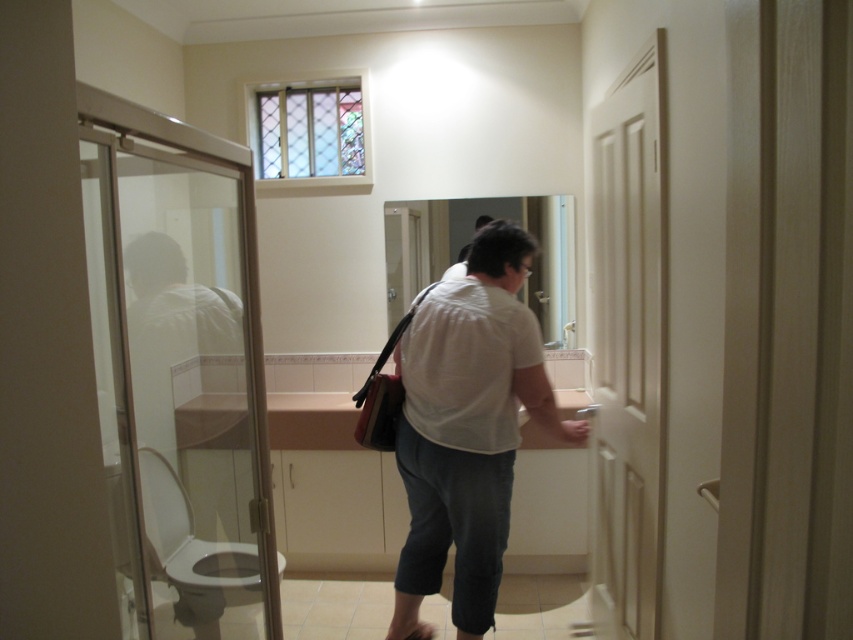
Between point (654, 579) and point (576, 376), which one is positioned in front?

Positioned in front is point (654, 579).

Which of these two, white matte door at right or white glossy sink at center, stands taller?

white matte door at right

Who is more distant from viewer, (619,292) or (552,380)?

The point (552,380) is behind.

Where is `white matte door at right`? The height and width of the screenshot is (640, 853). white matte door at right is located at coordinates (627, 349).

Does white matte shirt at center appear on the left side of white glossy sink at center?

Indeed, white matte shirt at center is positioned on the left side of white glossy sink at center.

Measure the distance between white matte shirt at center and white glossy sink at center.

white matte shirt at center is 3.35 feet from white glossy sink at center.

Does point (575, 428) come in front of point (576, 362)?

Yes, point (575, 428) is in front of point (576, 362).

I want to click on white matte shirt at center, so click(467, 428).

From the picture: Which is more to the right, white matte shirt at center or white matte door at right?

Positioned to the right is white matte door at right.

Does white matte shirt at center have a lesser height compared to white matte door at right?

Yes.

Is point (451, 424) positioned in front of point (659, 536)?

That is False.

At what (x,y) coordinates should I click in order to perform the action: click on white matte shirt at center. Please return your answer as a coordinate pair (x, y). Looking at the image, I should click on (467, 428).